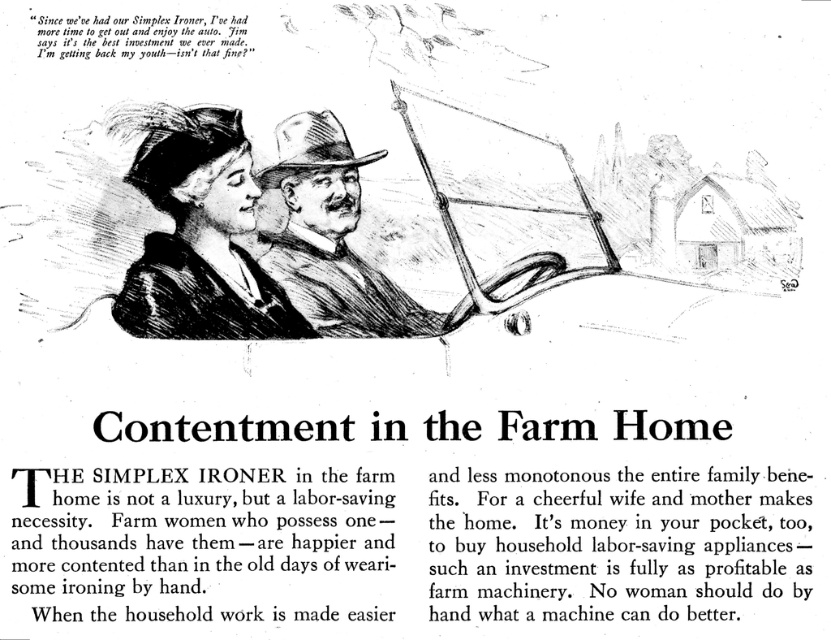
You are a photographer standing at the base of a tall building. You want to take a photo of the matte black dress at upper left and the brown textured hat at center in the vintage advertisement image. The camera you are using has a maximum focus range of 6 meters. Can you capture both subjects in focus without moving your position?

The distance between the matte black dress at upper left and the brown textured hat at center is 6.79 meters, which exceeds the camera maximum focus range of 6 meters. Therefore, you cannot capture both subjects in focus without moving your position.

You are examining the vintage Simplex Ironer advertisement. There are two points marked in the image. From your perspective, which point is closer to you? The points are labeled as point 1 at coordinates (x=187, y=307) and point 2 at coordinates (x=328, y=124). Please answer based on their positions in the image.

Point 1 at coordinates (x=187, y=307) is closer to the viewer than point 2 at coordinates (x=328, y=124).

In the vintage Simplex Ironer advertisement, there is a matte black dress at upper left. Where exactly is it located in terms of coordinates?

The matte black dress at upper left is located at coordinates point (200, 236).